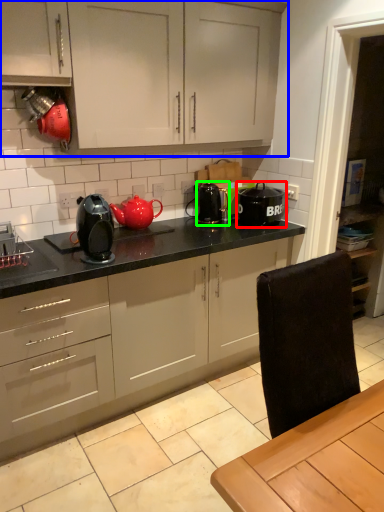
Question: Which object is positioned farthest from kitchen appliance (highlighted by a red box)? Select from cabinetry (highlighted by a blue box) and appliance (highlighted by a green box).

Choices:
 (A) cabinetry
 (B) appliance

Answer: (A)